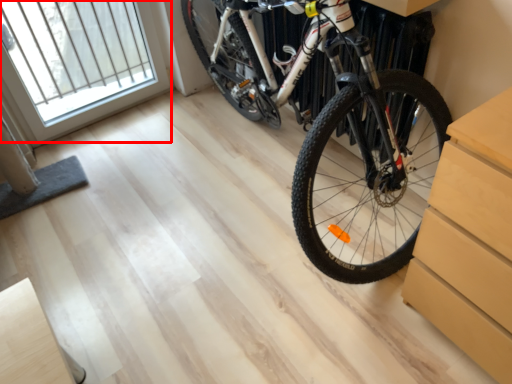
Question: Where is window (annotated by the red box) located in relation to bicycle in the image?

Choices:
 (A) left
 (B) right

Answer: (A)